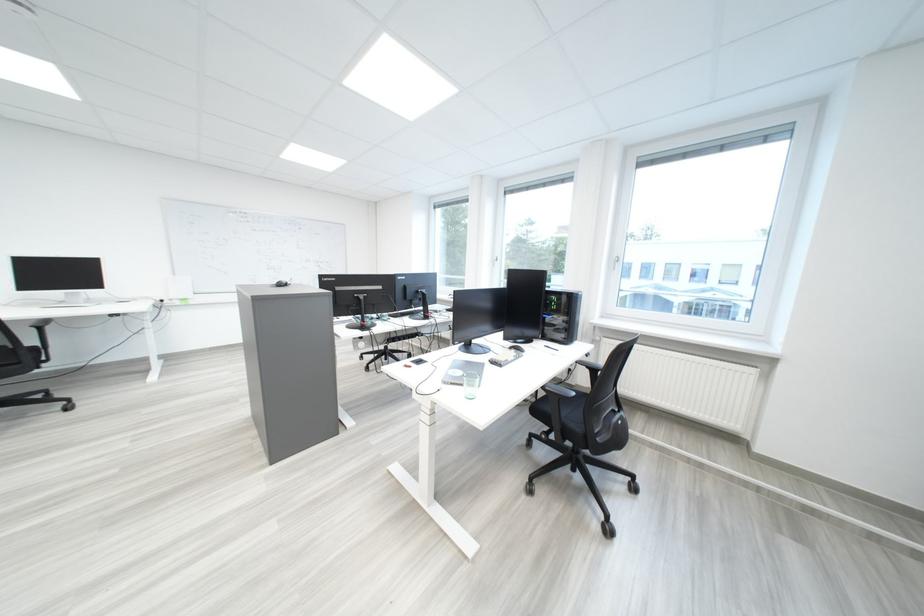
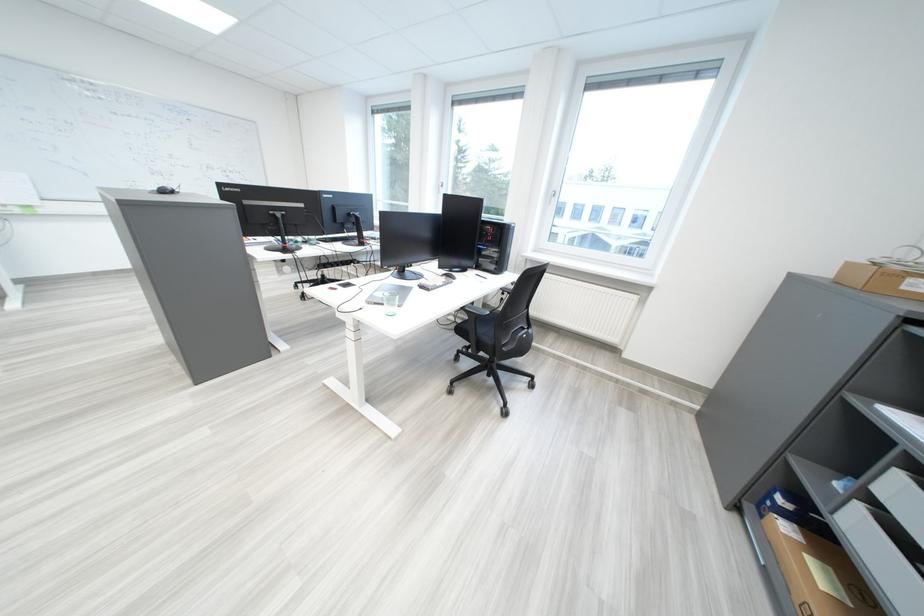
Locate, in the second image, the point that corresponds to [465,386] in the first image.

(388, 305)